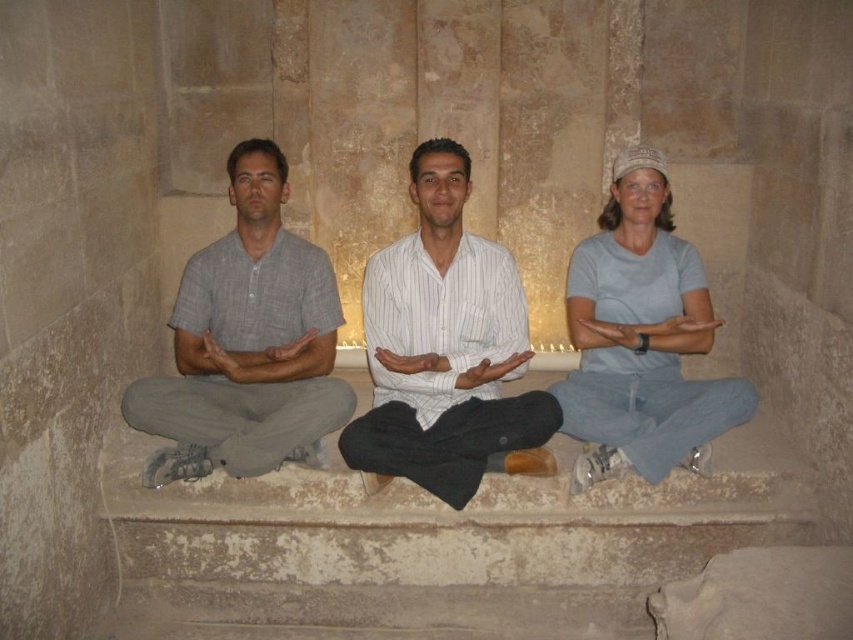
You are standing in front of the stone bench and want to greet both the gray cotton shirt at left and the light blue cotton shirt at center. Which person should you approach first based on their proximity to you?

You should approach the gray cotton shirt at left first because it is closer to you than the light blue cotton shirt at center.

You are a photographer trying to capture a group photo of the three individuals on the stone bench. You notice the white striped shirt at center and the light blue cotton shirt at center. Which of these two shirts is positioned higher in the image?

The white striped shirt at center is much taller than the light blue cotton shirt at center, so the white striped shirt at center is positioned higher in the image.